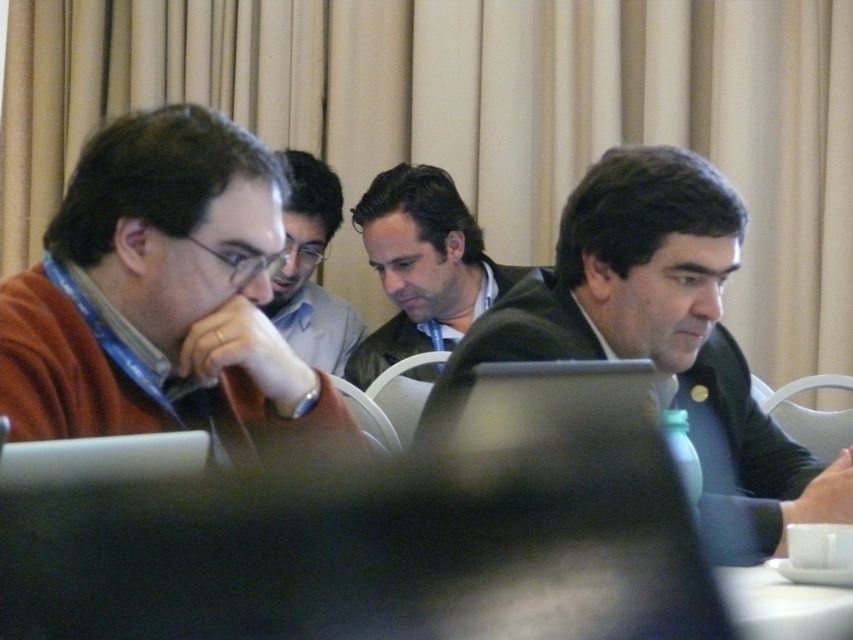
Question: Is dark brown leather jacket at center to the right of matte black shirt at center from the viewer's perspective?

Choices:
 (A) yes
 (B) no

Answer: (A)

Question: Based on their relative distances, which object is nearer to the matte black shirt at center?

Choices:
 (A) dark gray suit at right
 (B) matte brown sweater at left

Answer: (A)

Question: Can you confirm if dark brown leather jacket at center is smaller than matte black shirt at center?

Choices:
 (A) yes
 (B) no

Answer: (B)

Question: Which of the following is the closest to the observer?

Choices:
 (A) (721, 256)
 (B) (746, 621)
 (C) (422, 294)
 (D) (97, 141)

Answer: (B)

Question: Observing the image, what is the correct spatial positioning of matte brown sweater at left in reference to dark gray suit at right?

Choices:
 (A) left
 (B) right

Answer: (A)

Question: Which object is the closest to the white glossy table at lower right?

Choices:
 (A) matte black shirt at center
 (B) matte brown sweater at left

Answer: (B)